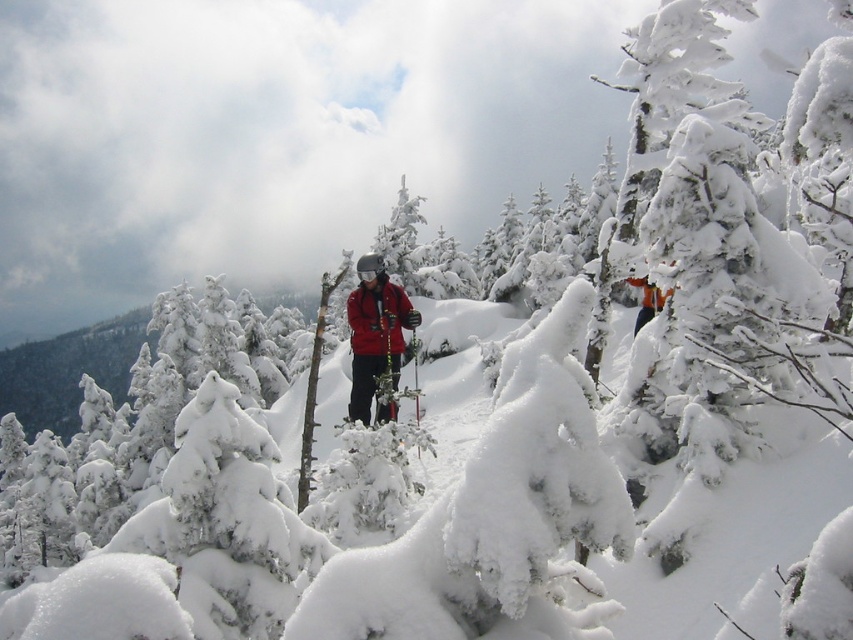
Who is taller, matte red jacket at center or orange ski jacket at center?

matte red jacket at center is taller.

Is point (387, 276) more distant than point (634, 280)?

No.

Does point (358, 400) come farther from viewer compared to point (642, 294)?

No.

Identify the location of matte red jacket at center. The image size is (853, 640). (375, 332).